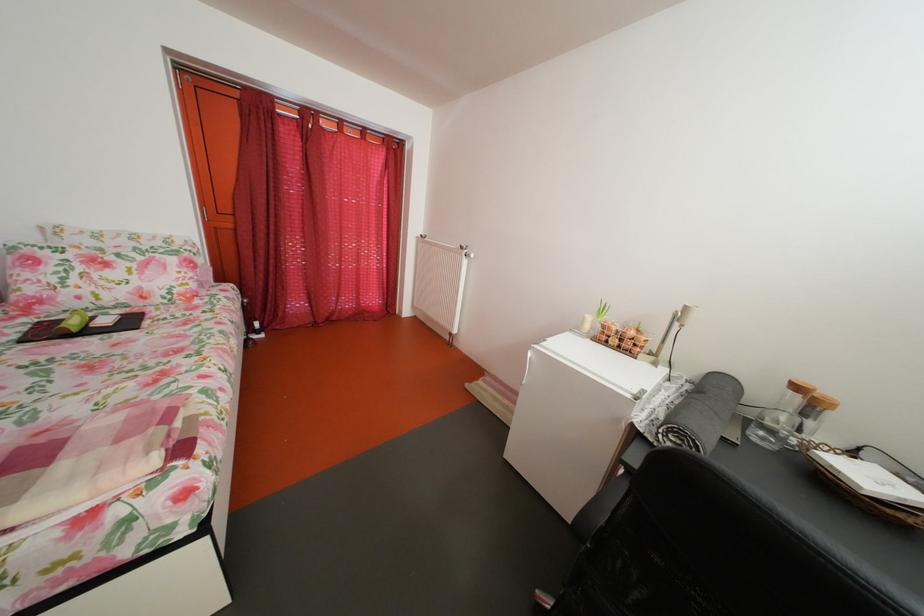
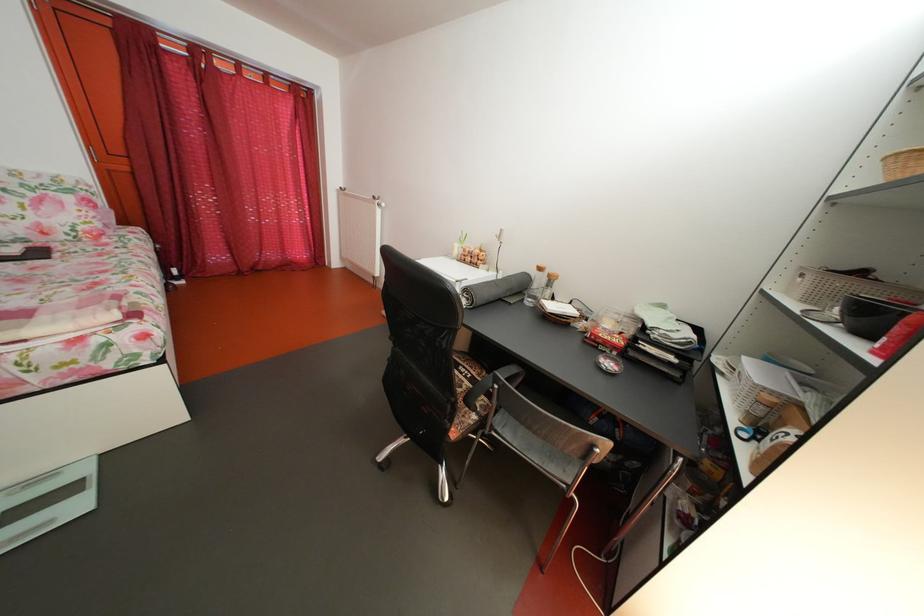
Question: The images are taken continuously from a first-person perspective. In which direction is your viewpoint rotating?

Choices:
 (A) Left
 (B) Right
 (C) Up
 (D) Down

Answer: (B)